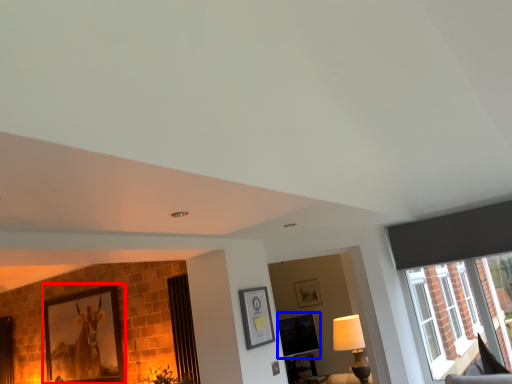
Question: Which object is closer to the camera taking this photo, picture frame (highlighted by a red box) or window screen (highlighted by a blue box)?

Choices:
 (A) picture frame
 (B) window screen

Answer: (A)